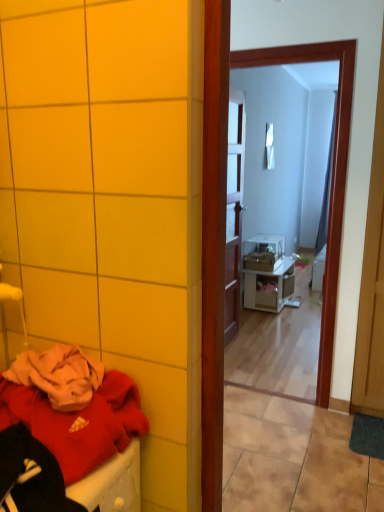
The height and width of the screenshot is (512, 384). What are the coordinates of `white glossy nightstand at center` in the screenshot? It's located at (270, 287).

What do you see at coordinates (332, 176) in the screenshot? I see `white glossy mirror at upper center, which is the 2th mirror from back to front` at bounding box center [332, 176].

This screenshot has width=384, height=512. In order to click on white glossy nightstand at center in this screenshot , I will do `click(270, 287)`.

Looking at the image, does white glossy mirror at upper center, arranged as the first mirror when viewed from the back, seem bigger or smaller compared to white glossy nightstand at center?

white glossy mirror at upper center, arranged as the first mirror when viewed from the back, is smaller than white glossy nightstand at center.

Is white glossy mirror at upper center, arranged as the first mirror when viewed from the back, not within white glossy nightstand at center?

Yes, white glossy mirror at upper center, arranged as the first mirror when viewed from the back, is located beyond the bounds of white glossy nightstand at center.

From the image's perspective, is white glossy mirror at upper center, placed as the 1th mirror when sorted from right to left, positioned above or below white glossy nightstand at center?

Based on their image positions, white glossy mirror at upper center, placed as the 1th mirror when sorted from right to left, is located above white glossy nightstand at center.

Is white glossy mirror at upper center, which is counted as the second mirror, starting from the bottom, facing towards white glossy nightstand at center?

No, white glossy mirror at upper center, which is counted as the second mirror, starting from the bottom, is not oriented towards white glossy nightstand at center.

Which object is further away from the camera, wooden door at center or white glossy nightstand at center?

Positioned behind is white glossy nightstand at center.

Consider the image. Considering the relative sizes of wooden door at center and white glossy nightstand at center in the image provided, is wooden door at center shorter than white glossy nightstand at center?

No, wooden door at center is not shorter than white glossy nightstand at center.

Is wooden door at center looking in the opposite direction of white glossy nightstand at center?

No, wooden door at center's orientation is not away from white glossy nightstand at center.

Is wooden door at center facing towards matte red sweater at lower left?

No, wooden door at center does not turn towards matte red sweater at lower left.

Is matte red sweater at lower left a part of wooden door at center?

No, wooden door at center does not contain matte red sweater at lower left.

From a real-world perspective, who is located higher, wooden door at center or matte red sweater at lower left?

From a 3D spatial view, wooden door at center is above.

Does white glossy nightstand at center have a greater height compared to matte red sweater at lower left?

Indeed, white glossy nightstand at center has a greater height compared to matte red sweater at lower left.

Can you see white glossy nightstand at center touching matte red sweater at lower left?

white glossy nightstand at center is not next to matte red sweater at lower left, and they're not touching.

Can we say white glossy nightstand at center lies outside matte red sweater at lower left?

Yes, white glossy nightstand at center is outside of matte red sweater at lower left.

How different are the orientations of white glossy nightstand at center and matte red sweater at lower left in degrees?

white glossy nightstand at center and matte red sweater at lower left are facing 1.09 degrees away from each other.

From a real-world perspective, is white glossy mirror at upper center, which ranks as the 2th mirror in left-to-right order, positioned above or below white glossy mirror at upper center, the first mirror viewed from the front?

white glossy mirror at upper center, which ranks as the 2th mirror in left-to-right order, is situated higher than white glossy mirror at upper center, the first mirror viewed from the front, in the real world.

Is white glossy mirror at upper center, arranged as the first mirror when viewed from the back, surrounding white glossy mirror at upper center, acting as the 2th mirror starting from the top?

Definitely not — white glossy mirror at upper center, acting as the 2th mirror starting from the top, is not inside white glossy mirror at upper center, arranged as the first mirror when viewed from the back.

Considering the sizes of objects white glossy mirror at upper center, placed as the 1th mirror when sorted from right to left, and white glossy mirror at upper center, which ranks as the 1th mirror in left-to-right order, in the image provided, who is thinner, white glossy mirror at upper center, placed as the 1th mirror when sorted from right to left, or white glossy mirror at upper center, which ranks as the 1th mirror in left-to-right order,?

With smaller width is white glossy mirror at upper center, placed as the 1th mirror when sorted from right to left.

Considering the relative positions of white glossy mirror at upper center, which is counted as the second mirror, starting from the bottom, and white glossy mirror at upper center, which ranks as the 1th mirror in left-to-right order, in the image provided, is white glossy mirror at upper center, which is counted as the second mirror, starting from the bottom, to the right of white glossy mirror at upper center, which ranks as the 1th mirror in left-to-right order, from the viewer's perspective?

Yes.

What's the angular difference between white glossy mirror at upper center, which is the 2th mirror from back to front, and matte red sweater at lower left's facing directions?

white glossy mirror at upper center, which is the 2th mirror from back to front, and matte red sweater at lower left are facing 89.8 degrees away from each other.

Which mirror is the 1st one when counting from the back of the matte red sweater at lower left? Please provide its 2D coordinates.

[(332, 176)]

From the image's perspective, who appears lower, white glossy mirror at upper center, which is the 2th mirror in right-to-left order, or matte red sweater at lower left?

matte red sweater at lower left.

Is white glossy mirror at upper center, the 1th mirror positioned from the bottom, wider than matte red sweater at lower left?

Incorrect, the width of white glossy mirror at upper center, the 1th mirror positioned from the bottom, does not surpass that of matte red sweater at lower left.

Is white glossy nightstand at center next to wooden door at center and touching it?

No.

Could you tell me if white glossy nightstand at center is facing wooden door at center?

No, white glossy nightstand at center does not turn towards wooden door at center.

In the scene shown: Considering the sizes of objects white glossy nightstand at center and wooden door at center in the image provided, who is shorter, white glossy nightstand at center or wooden door at center?

white glossy nightstand at center is shorter.

Between white glossy nightstand at center and wooden door at center, which one has larger width?

white glossy nightstand at center is wider.

This screenshot has height=512, width=384. Find the location of `nightstand below the white glossy mirror at upper center, placed as the 1th mirror when sorted from right to left (from the image's perspective)`. nightstand below the white glossy mirror at upper center, placed as the 1th mirror when sorted from right to left (from the image's perspective) is located at coordinates (270, 287).

Find the location of a particular element. The width and height of the screenshot is (384, 512). door above the white glossy nightstand at center (from the image's perspective) is located at coordinates (234, 211).

Based on the photo, looking at the image, which one is located further to white glossy mirror at upper center, the 1th mirror positioned from the bottom, matte red sweater at lower left or white glossy nightstand at center?

white glossy nightstand at center lies further to white glossy mirror at upper center, the 1th mirror positioned from the bottom, than the other object.

Considering their positions, is white glossy mirror at upper center, acting as the 2th mirror starting from the top, positioned further to white glossy mirror at upper center, positioned as the 2th mirror in front-to-back order, than white glossy nightstand at center?

white glossy mirror at upper center, acting as the 2th mirror starting from the top.

From the image, which object appears to be farther from matte red sweater at lower left, wooden door at center or white glossy mirror at upper center, which ranks as the 1th mirror in left-to-right order?

wooden door at center lies further to matte red sweater at lower left than the other object.

Looking at the image, which one is located further to white glossy mirror at upper center, which ranks as the 1th mirror in left-to-right order, wooden door at center or white glossy mirror at upper center, acting as the 1th mirror starting from the top?

white glossy mirror at upper center, acting as the 1th mirror starting from the top, is positioned further to the anchor white glossy mirror at upper center, which ranks as the 1th mirror in left-to-right order.

Looking at the image, which one is located closer to white glossy mirror at upper center, the 1th mirror positioned from the bottom, matte red sweater at lower left or wooden door at center?

wooden door at center is closer to white glossy mirror at upper center, the 1th mirror positioned from the bottom.

Considering their positions, is white glossy mirror at upper center, arranged as the first mirror when viewed from the back, positioned further to white glossy mirror at upper center, the 1th mirror positioned from the bottom, than matte red sweater at lower left?

white glossy mirror at upper center, arranged as the first mirror when viewed from the back.

When comparing their distances from wooden door at center, does white glossy mirror at upper center, placed as the 1th mirror when sorted from right to left, or white glossy nightstand at center seem closer?

Among the two, white glossy mirror at upper center, placed as the 1th mirror when sorted from right to left, is located nearer to wooden door at center.

Considering their positions, is white glossy nightstand at center positioned closer to white glossy mirror at upper center, acting as the 1th mirror starting from the top, than wooden door at center?

wooden door at center.

I want to click on mirror located between matte red sweater at lower left and wooden door at center in the depth direction, so click(x=332, y=176).

Identify the location of door between matte red sweater at lower left and white glossy nightstand at center in the front-back direction. This screenshot has width=384, height=512. (234, 211).

This screenshot has height=512, width=384. I want to click on nightstand between white glossy mirror at upper center, which is the 2th mirror in right-to-left order, and white glossy mirror at upper center, which ranks as the 2th mirror in left-to-right order, along the z-axis, so click(x=270, y=287).

At what (x,y) coordinates should I click in order to perform the action: click on mirror between matte red sweater at lower left and white glossy mirror at upper center, which is counted as the second mirror, starting from the bottom, along the z-axis. Please return your answer as a coordinate pair (x, y). Looking at the image, I should click on click(332, 176).